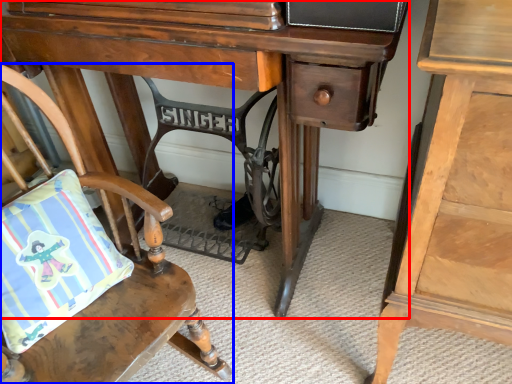
Question: Among these objects, which one is farthest to the camera, desk (highlighted by a red box) or chair (highlighted by a blue box)?

Choices:
 (A) desk
 (B) chair

Answer: (A)